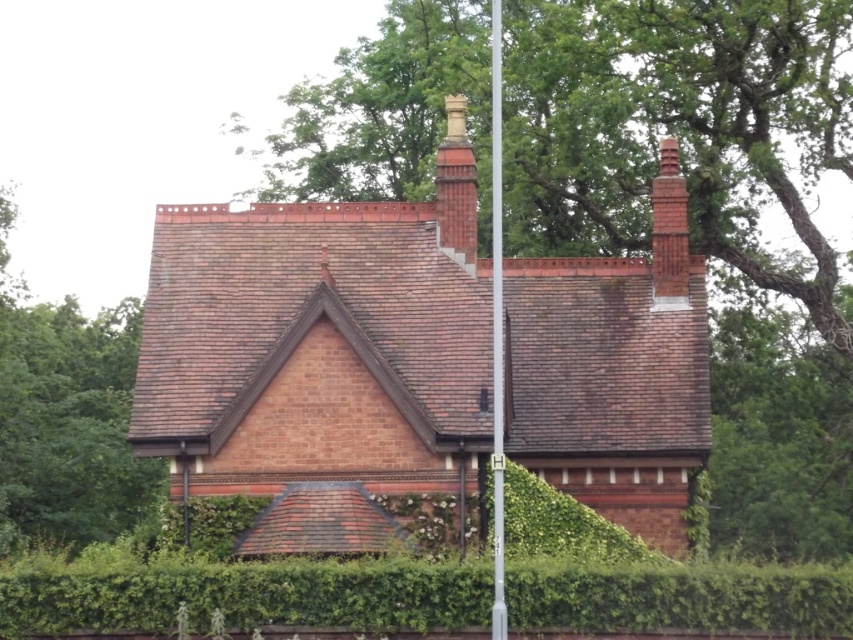
You are a gardener planning to trim the green leafy hedge at lower center and the brown shingles at left. Which of these two objects takes up more space in the image?

The brown shingles at left occupy more space than the green leafy hedge at lower center.

You are standing in front of the house and want to plant a new tree in the same position as the green leafy tree at upper center. What are the coordinates where you should plant the tree?

The green leafy tree at upper center should be planted at coordinates (679, 129).

You are a gardener planning to trim the green leafy hedge at lower center and the brown shingles at left. Which of these two objects requires more effort to maintain due to its larger size?

The brown shingles at left require more effort to maintain because they are wider than the green leafy hedge at lower center.